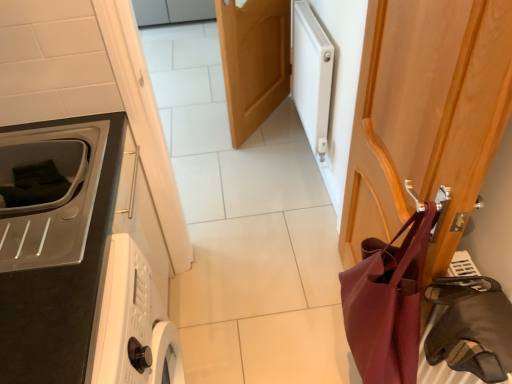
Where is `vacant location below white matte radiator at upper right (from a real-world perspective)`? This screenshot has height=384, width=512. vacant location below white matte radiator at upper right (from a real-world perspective) is located at coordinates (308, 151).